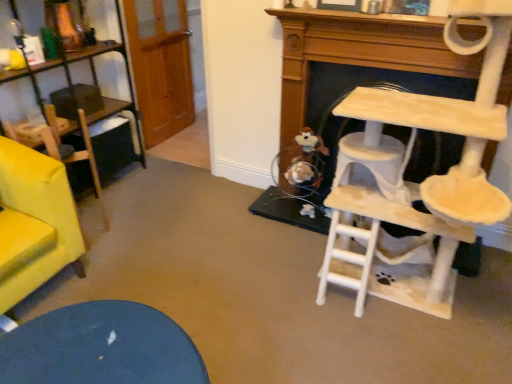
You are a GUI agent. You are given a task and a screenshot of the screen. Output one action in this format:
    pyautogui.click(x=<x>, y=<y>)
    Task: Click on the free spot below beige wooden cat tree at right (from a real-world perspective)
    The height and width of the screenshot is (384, 512).
    Given the screenshot: What is the action you would take?
    pyautogui.click(x=393, y=306)